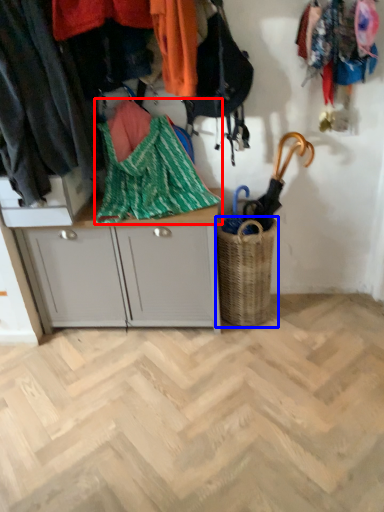
Question: Which object is further to the camera taking this photo, blanket (highlighted by a red box) or basket (highlighted by a blue box)?

Choices:
 (A) blanket
 (B) basket

Answer: (B)